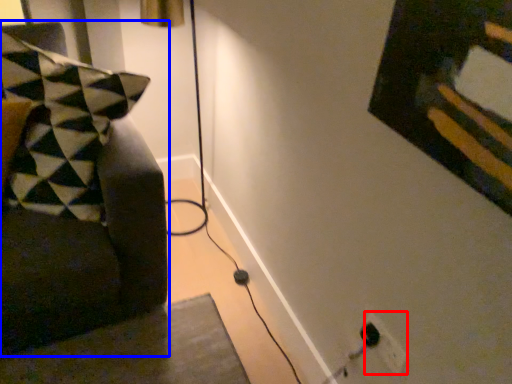
Question: Which object appears closest to the camera in this image, electric outlet (highlighted by a red box) or furniture (highlighted by a blue box)?

Choices:
 (A) electric outlet
 (B) furniture

Answer: (B)